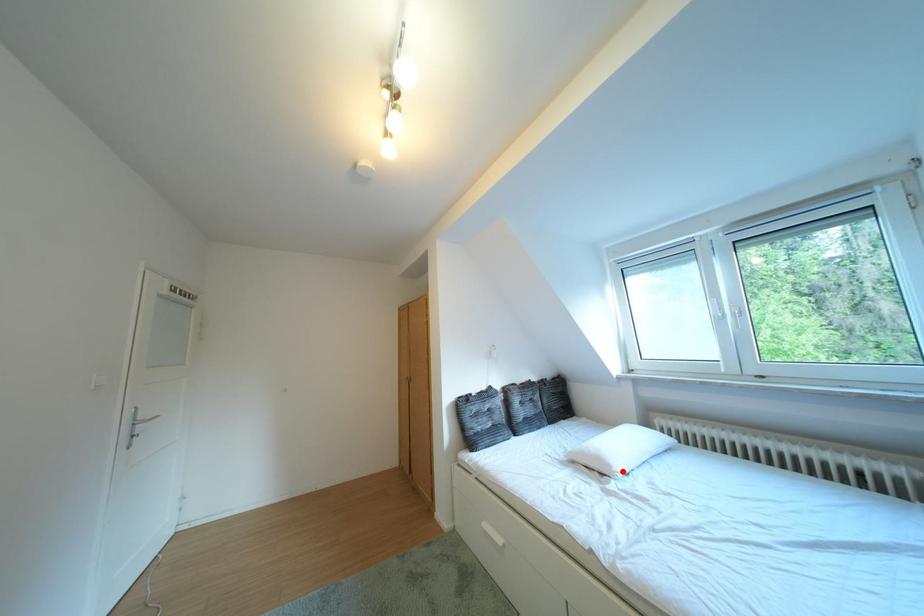
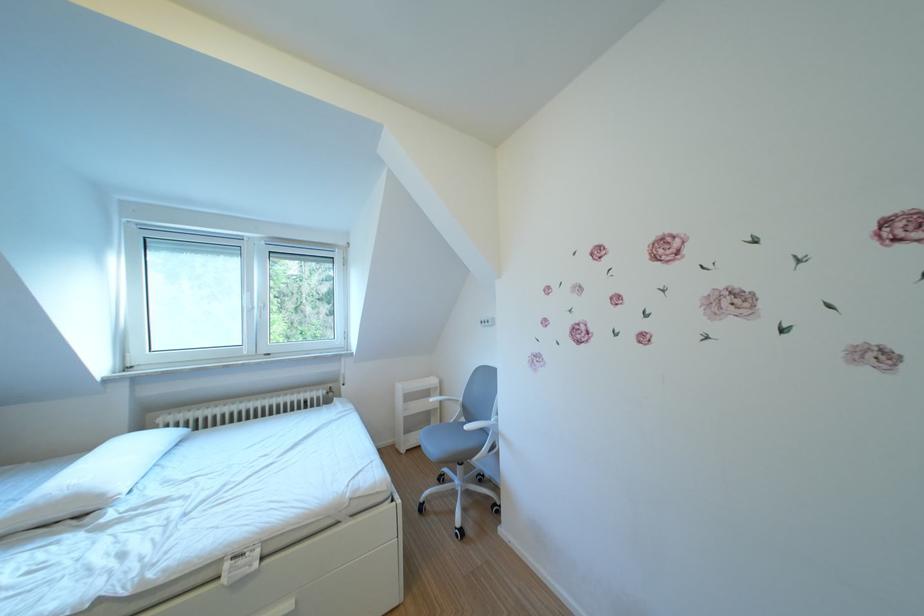
In the second image, find the point that corresponds to the highlighted location in the first image.

(115, 501)